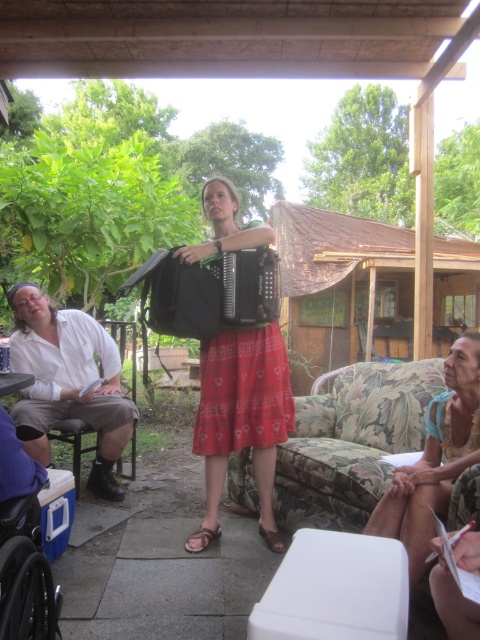
In the scene shown: Between white cotton shirt at left and black matte accordion at center, which one has more height?

white cotton shirt at left

Is point (38, 435) more distant than point (235, 269)?

Yes.

Image resolution: width=480 pixels, height=640 pixels. I want to click on white cotton shirt at left, so click(x=68, y=381).

Who is positioned more to the left, matte black accordion at center or blue fabric headband at lower right?

matte black accordion at center is more to the left.

Which is behind, point (245, 342) or point (394, 490)?

Positioned behind is point (245, 342).

The height and width of the screenshot is (640, 480). Find the location of `matte black accordion at center`. matte black accordion at center is located at coordinates (241, 419).

Which is more to the left, matte black accordion at center or black plastic wheelchair at lower left?

black plastic wheelchair at lower left

The image size is (480, 640). I want to click on matte black accordion at center, so click(x=241, y=419).